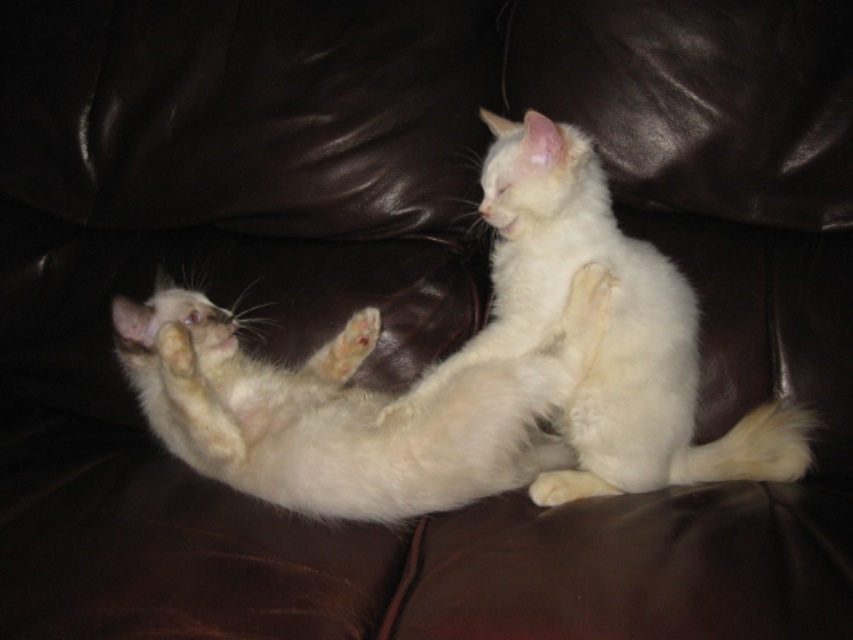
You are a photographer trying to capture a photo of both the white fluffy cat at center and the white fluffy cat at upper right. Since the lighting is dim, you need to adjust your camera settings to ensure both cats are in focus. Based on their positions, which cat should you focus on first to ensure the other remains in focus?

You should focus on the white fluffy cat at upper right first because it is farther away from the camera than the white fluffy cat at center. By focusing on the farther cat, the closer cat will also be in focus due to the depth of field.

You are a photographer trying to capture both the white fluffy cat at center and the white fluffy cat at upper right in a single shot. Based on their heights, which cat should you focus on first to ensure both are in frame?

The white fluffy cat at center is shorter than the white fluffy cat at upper right. To ensure both are in frame, focus on the white fluffy cat at upper right first as it is taller and adjust the camera angle accordingly.